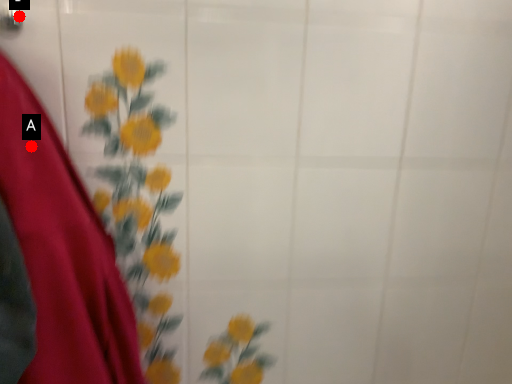
Question: Two points are circled on the image, labeled by A and B beside each circle. Among these points, which one is nearest to the camera?

Choices:
 (A) A is closer
 (B) B is closer

Answer: (A)